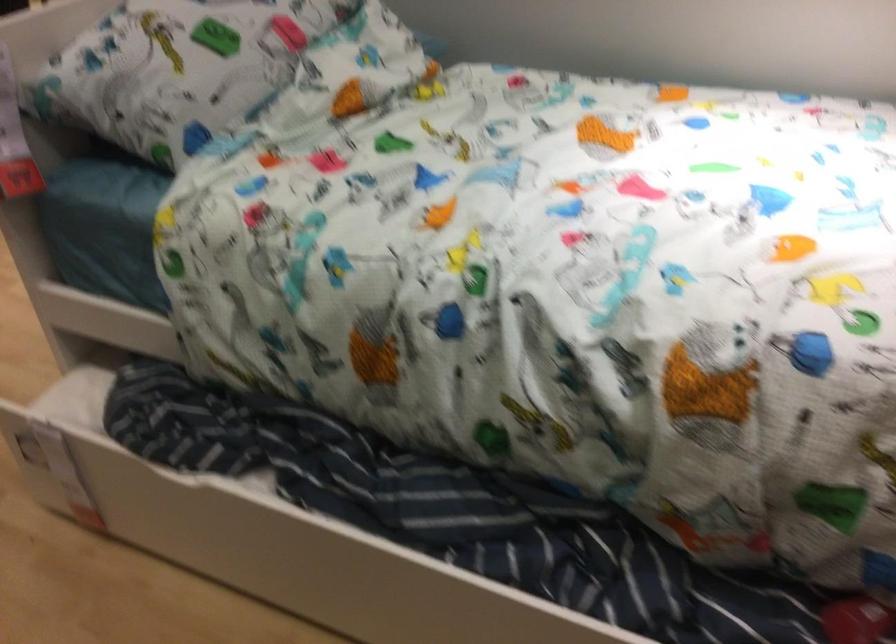
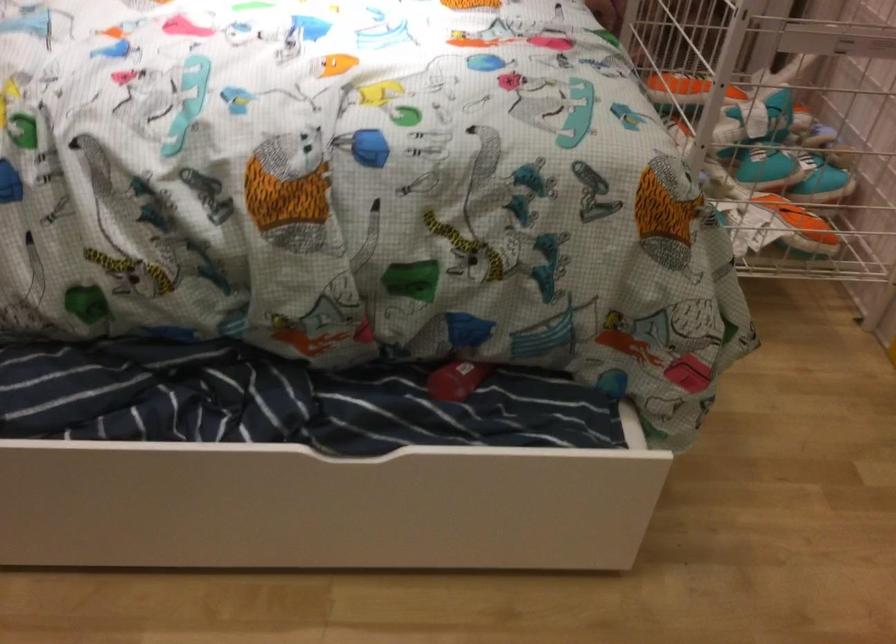
Question: The camera is either moving clockwise (left) or counter-clockwise (right) around the object. The first image is from the beginning of the video and the second image is from the end. Is the camera moving left or right when shooting the video?

Choices:
 (A) Left
 (B) Right

Answer: (A)